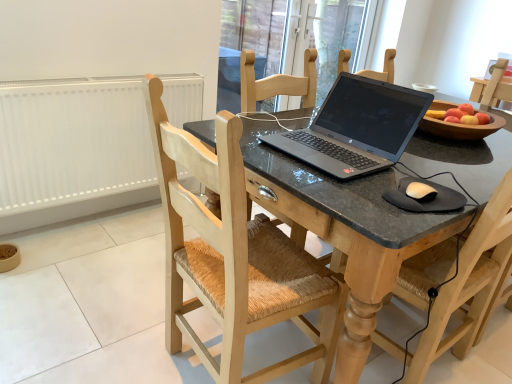
This screenshot has height=384, width=512. Find the location of `unoccupied area behind black rubber mousepad at lower right`. unoccupied area behind black rubber mousepad at lower right is located at coordinates (418, 172).